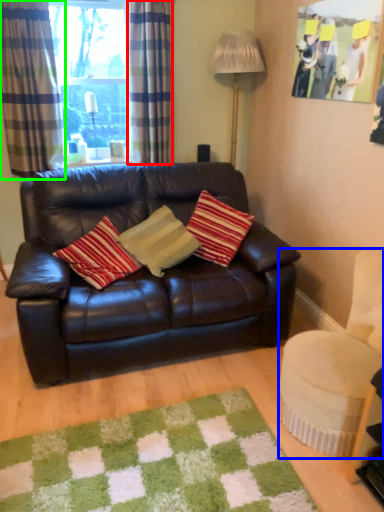
Question: Which object is positioned closest to curtain (highlighted by a red box)? Select from swivel chair (highlighted by a blue box) and curtain (highlighted by a green box).

Choices:
 (A) swivel chair
 (B) curtain

Answer: (B)